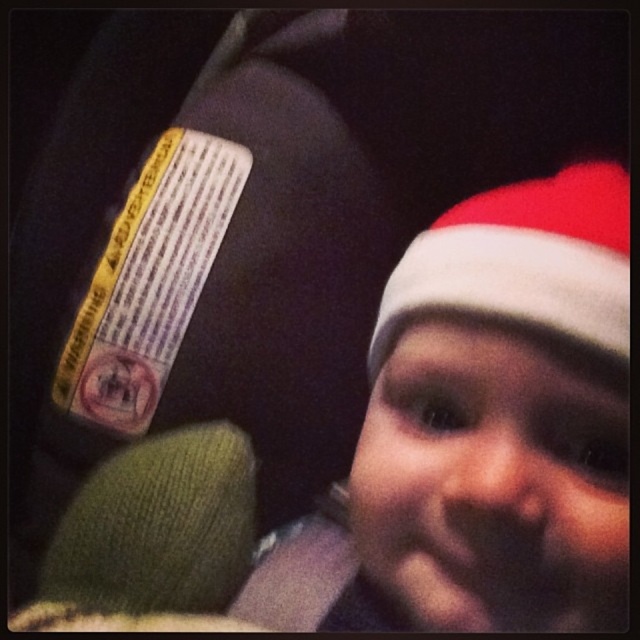
Between point (612, 545) and point (518, 304), which one is positioned behind?

Positioned behind is point (612, 545).

Who is positioned more to the right, white knit hat at upper right or red velvet santa hat at upper right?

red velvet santa hat at upper right is more to the right.

Is point (404, 400) behind point (396, 291)?

That is False.

At what (x,y) coordinates should I click in order to perform the action: click on white knit hat at upper right. Please return your answer as a coordinate pair (x, y). Image resolution: width=640 pixels, height=640 pixels. Looking at the image, I should click on (410, 456).